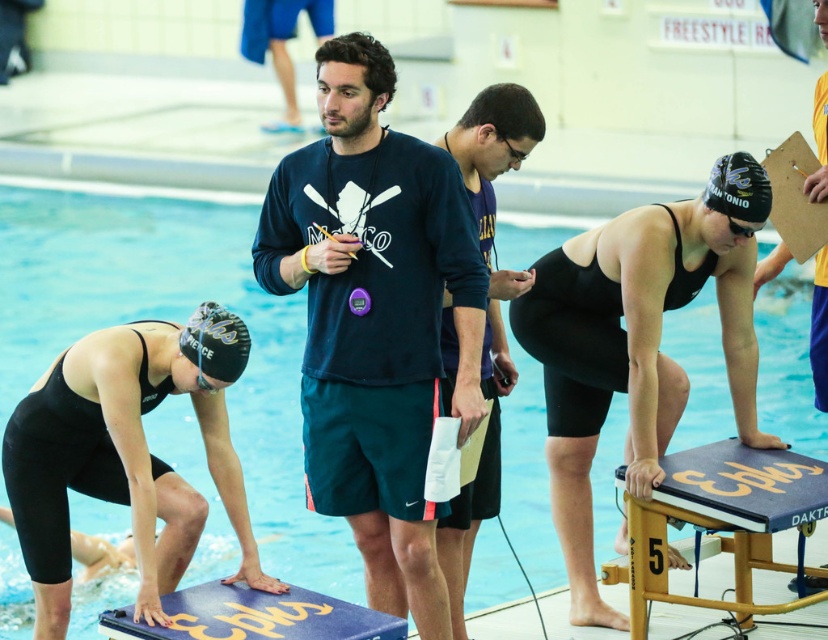
How distant is black matte swimsuit at center from blue foam diving board at lower center?

black matte swimsuit at center and blue foam diving board at lower center are 7.84 feet apart.

Who is more distant from viewer, (676, 296) or (302, 636)?

The point (676, 296) is more distant.

Where is `black matte swimsuit at center`? The image size is (828, 640). black matte swimsuit at center is located at coordinates (638, 342).

Does blue smooth water at center appear under black matte diving board at center?

No, blue smooth water at center is not below black matte diving board at center.

Find the location of a particular element. Image resolution: width=828 pixels, height=640 pixels. blue smooth water at center is located at coordinates (174, 321).

Is navy blue sweatshirt at center below yellow jersey at right?

Yes, navy blue sweatshirt at center is below yellow jersey at right.

Describe the element at coordinates (482, 449) in the screenshot. This screenshot has width=828, height=640. I see `navy blue sweatshirt at center` at that location.

Which is behind, point (451, 579) or point (812, 336)?

Positioned behind is point (812, 336).

Identify the location of navy blue sweatshirt at center. (482, 449).